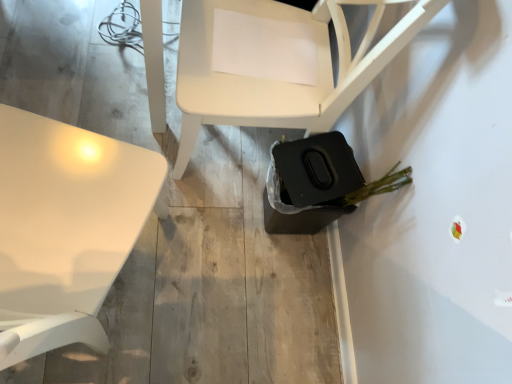
The width and height of the screenshot is (512, 384). Identify the location of vacant space in front of matte white chair at center. (236, 255).